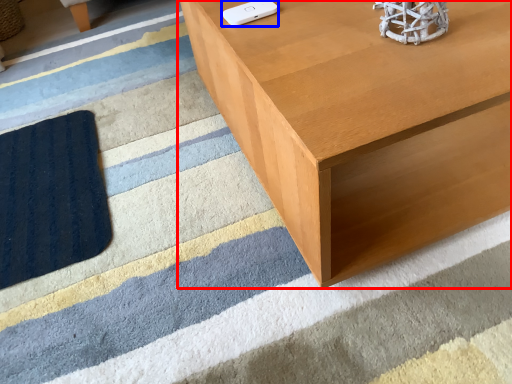
Question: Which object is further to the camera taking this photo, table (highlighted by a red box) or Wii controller (highlighted by a blue box)?

Choices:
 (A) table
 (B) Wii controller

Answer: (B)